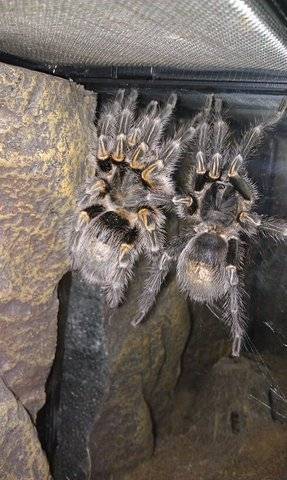
This screenshot has height=480, width=287. What are the coordinates of `wall` in the screenshot? It's located at (276, 173).